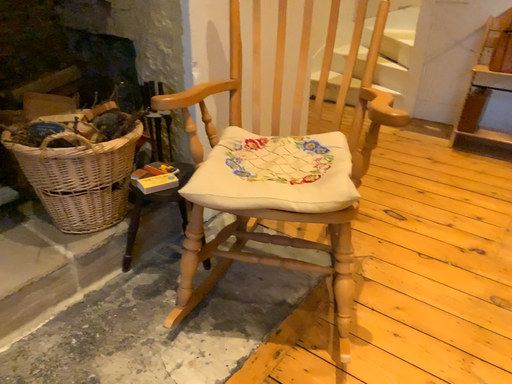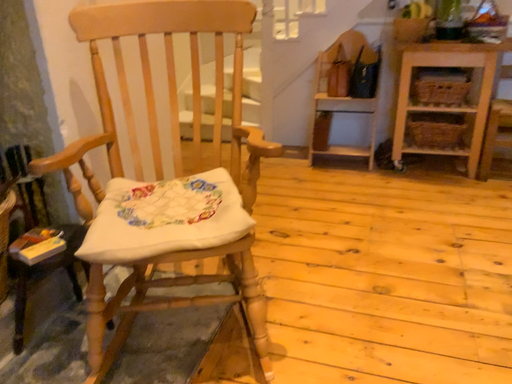
Question: Which way did the camera rotate in the video?

Choices:
 (A) rotated upward
 (B) rotated downward

Answer: (A)